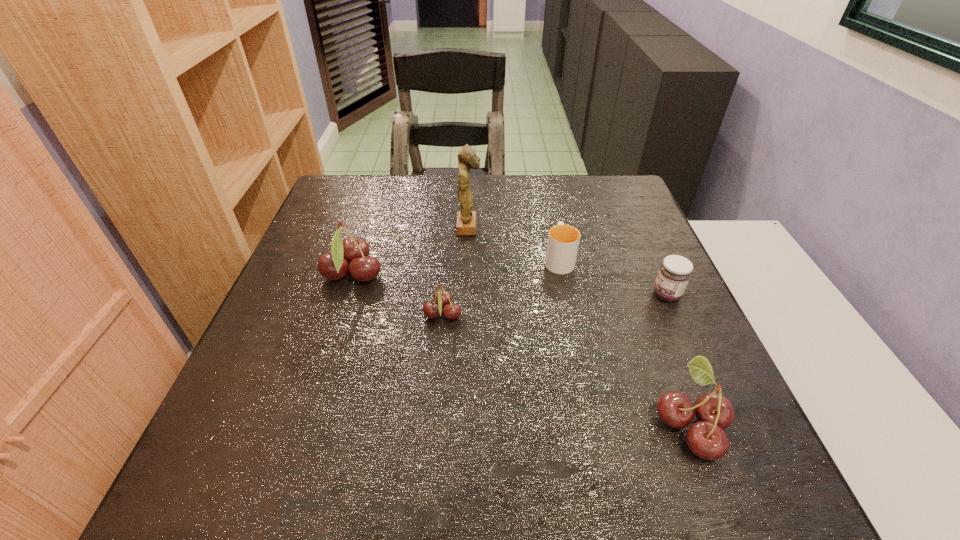
Locate an element on the screen. vacant position for inserting another cherry evenly is located at coordinates (553, 363).